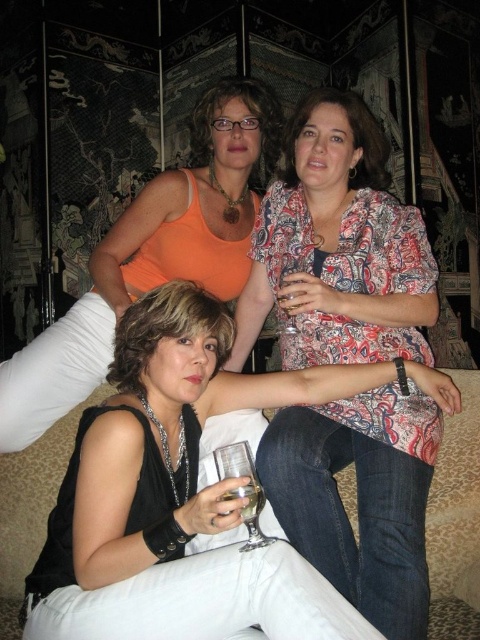
Consider the image. You are a photographer setting up a shoot in this scene. You need to ensure that the orange matte tank top at upper center and the clear glass wine glass at center are both visible in the frame. Given their sizes, which object should you prioritize positioning closer to the camera to maintain clarity?

The orange matte tank top at upper center has a larger size compared to the clear glass wine glass at center. Therefore, you should prioritize positioning the orange matte tank top at upper center closer to the camera to maintain clarity.

You are a photographer adjusting your camera settings to capture the orange matte tank top at upper center and the clear glass wine glass at center. Which object should you focus on first if you want both to be in sharp focus?

You should focus on the orange matte tank top at upper center first because it is closer to the viewer than the clear glass wine glass at center, ensuring both will be in focus when using a shallow depth of field.

You are a photographer setting up a shoot in this scene. You need to place a small prop between the black leather jacket at center and the clear glass at lower center so that it sits exactly halfway between them. Given their positions, where should you position this prop?

The black leather jacket at center is located below the clear glass at lower center, so placing the prop halfway between them would require positioning it midway along the vertical line connecting the two objects.